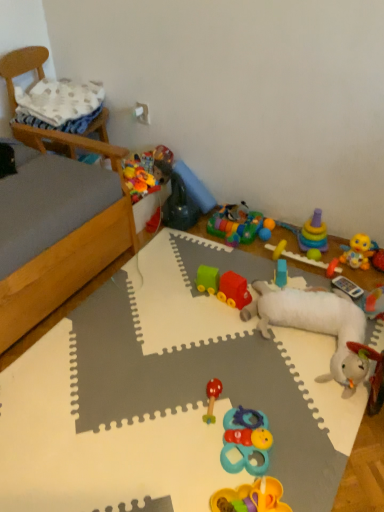
Image resolution: width=384 pixels, height=512 pixels. What are the coordinates of `vacant space to the left of blue rubber teething ring at center, the 10th toy in the top-to-bottom sequence` in the screenshot? It's located at tap(190, 448).